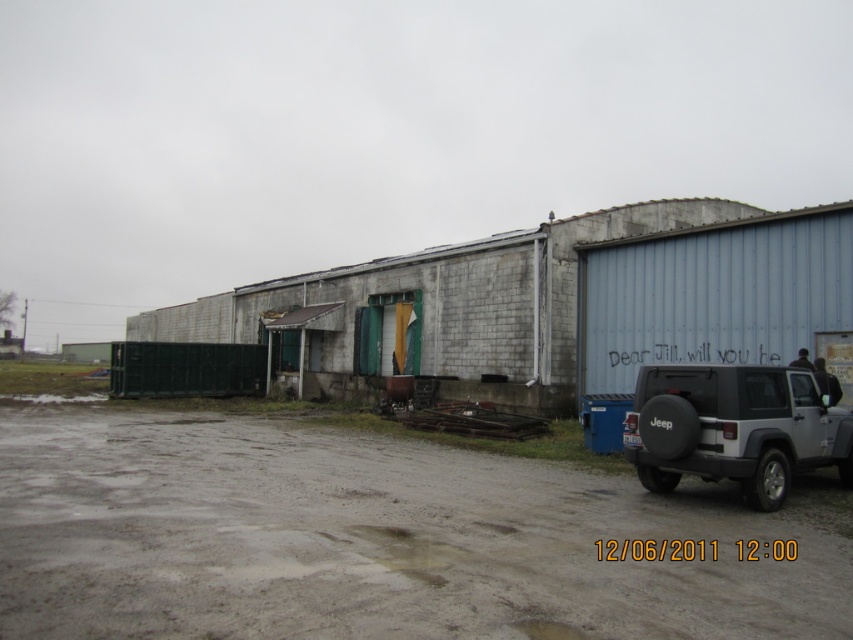
You are a delivery driver who needs to back your truck up to the loading dock. Your truck is 10 feet long. You see the gray dirt track at lower center and the silver matte jeep at right. Is there enough space between them for your truck to maneuver?

The gray dirt track at lower center is 8.31 feet away from the silver matte jeep at right. Since your truck is 10 feet long, there isn not enough space between them for your truck to maneuver.

You are driving a delivery truck that needs to turn around. You see the gray dirt track at lower center and the silver matte jeep at right. Which path should you choose to make a U turn?

The gray dirt track at lower center is in front of the silver matte jeep at right, so you should choose the gray dirt track at lower center to make a U turn since it is positioned in front and likely provides enough space.

You are standing in the industrial area and want to take a photo of the white Jeep parked on the right side. If you focus your camera on the point closer to you, which point should you choose between point (155, 525) and point (724, 394)?

You should focus on point (155, 525) because it is closer to the camera than point (724, 394).